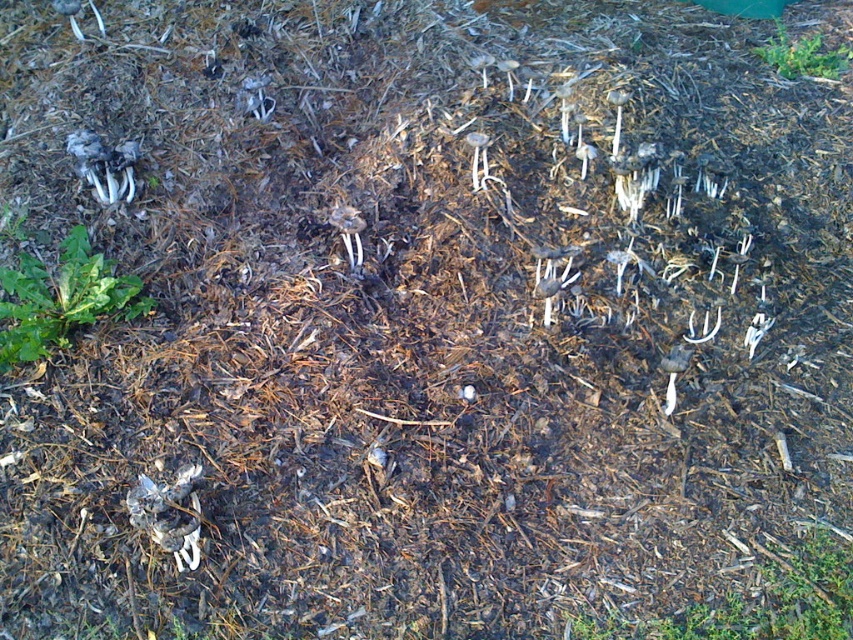
Based on the photo, who is more distant from viewer, (x=18, y=352) or (x=840, y=45)?

Point (x=840, y=45)

Locate an element on the screen. green leafy plant at lower left is located at coordinates (61, 298).

Describe the element at coordinates (61, 298) in the screenshot. This screenshot has width=853, height=640. I see `green leafy plant at lower left` at that location.

This screenshot has width=853, height=640. In order to click on green leafy plant at lower left in this screenshot , I will do `click(61, 298)`.